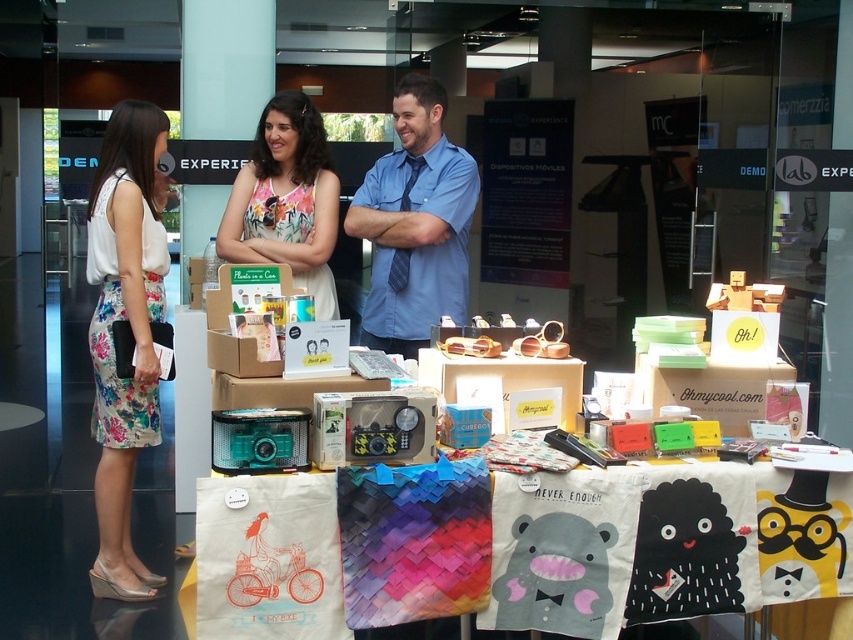
You are an event organizer who needs to arrange a photo shoot. The blue shirt at center and the matte cardboard box at lower right are both in the frame. Based on their sizes, which object should be placed closer to the camera to ensure both appear roughly the same size in the final photo?

The matte cardboard box at lower right should be placed closer to the camera because it is smaller in size compared to the blue shirt at center. By positioning the smaller object closer, their apparent sizes in the photo will be balanced.

Based on the scene description, where exactly is the floral fabric dress at center located in terms of coordinates?

The floral fabric dress at center is located at point coordinates of (286, 198).

What is located at the coordinates point [131,330]?

The point [131,330] is where the floral fabric skirt at left is located.